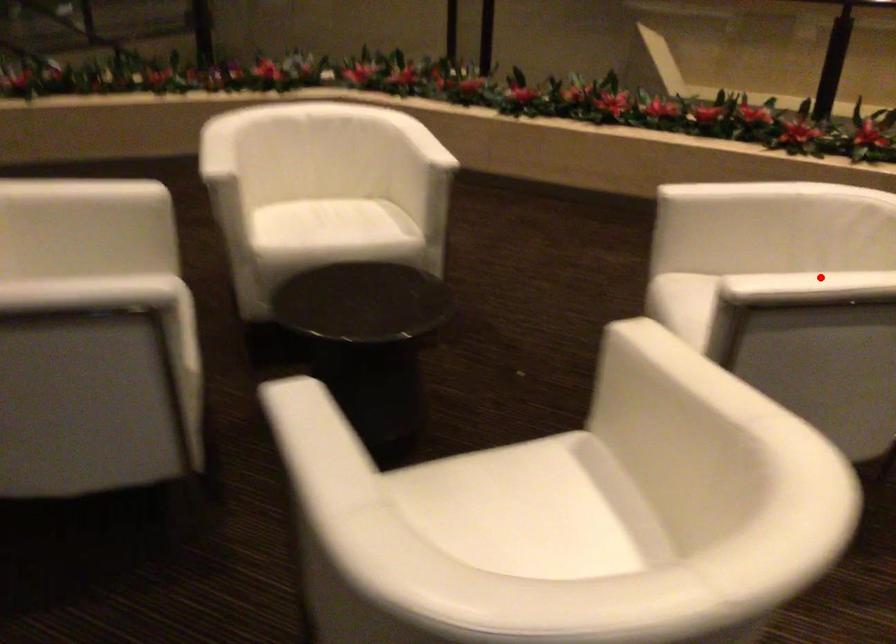
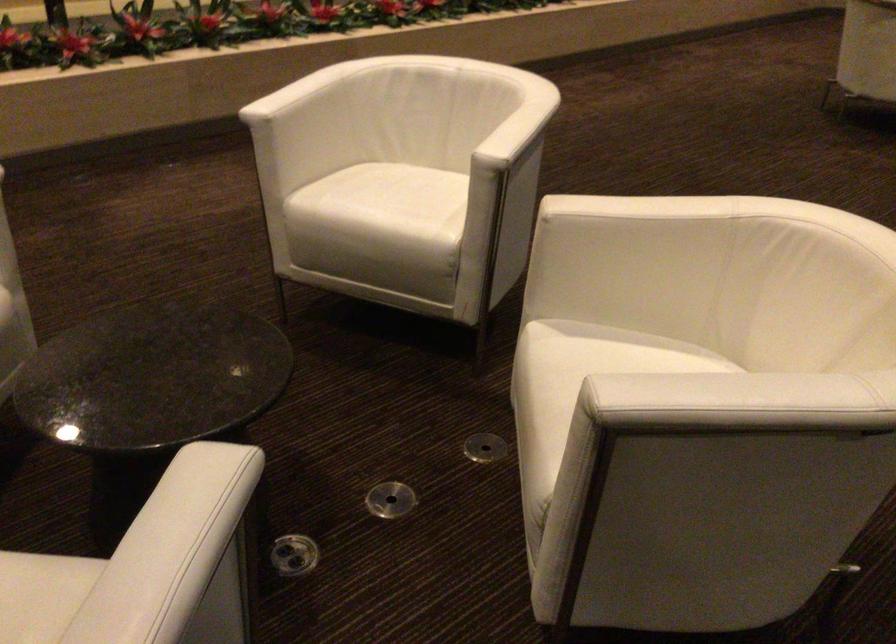
The point at the highlighted location is marked in the first image. Where is the corresponding point in the second image?

(515, 122)